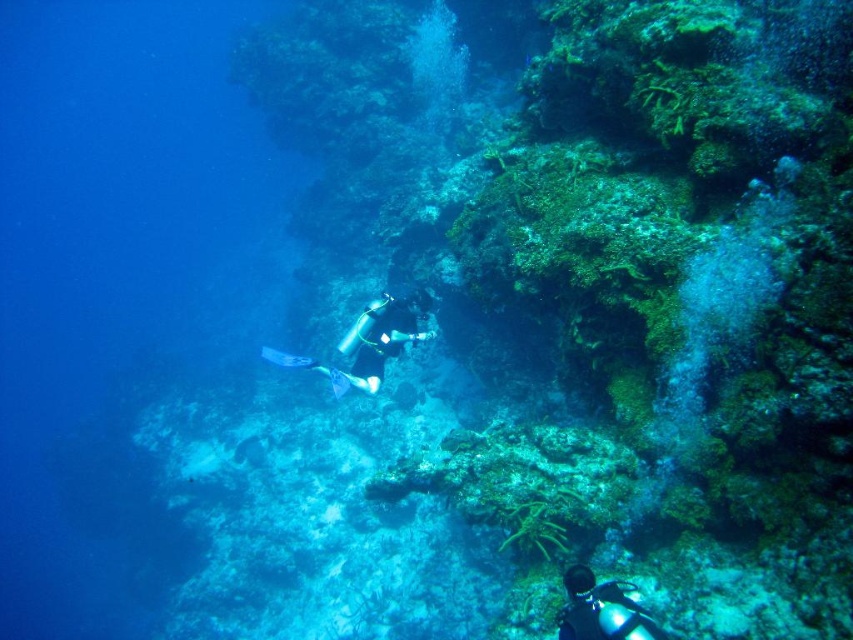
Based on the photo, which is below, black matte scuba diver at center or glossy blue diving suit at lower right?

glossy blue diving suit at lower right is lower down.

Identify the location of black matte scuba diver at center. This screenshot has width=853, height=640. (379, 339).

Locate an element on the screen. This screenshot has width=853, height=640. black matte scuba diver at center is located at coordinates [379, 339].